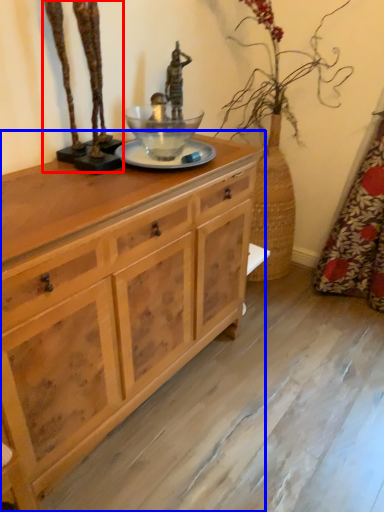
Question: Which point is closer to the camera, bronze statue (highlighted by a red box) or chest of drawers (highlighted by a blue box)?

Choices:
 (A) bronze statue
 (B) chest of drawers

Answer: (B)